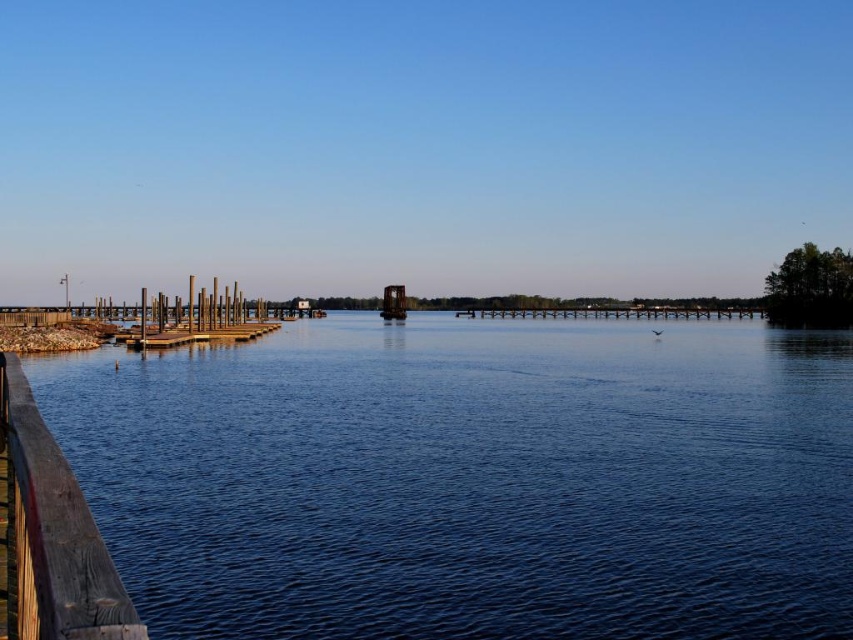
You are standing on a dock and see the blue water at lower left and the wooden textured rail at lower left. Which object is positioned lower in the scene?

The blue water at lower left is located below the wooden textured rail at lower left, so it is positioned lower in the scene.

You are standing on a wooden dock and want to walk towards the farther point. Which point should you head towards, point (801, 557) or point (387, 285)?

You should head towards point (387, 285) because it is farther from the viewer compared to point (801, 557), which is closer.

You are standing on a dock and want to know if the blue water at lower left is larger in size compared to the brown wooden rail at center. Based on the scene, can you confirm this?

The blue water at lower left is bigger than the brown wooden rail at center, so yes, the blue water at lower left is larger in size compared to the brown wooden rail at center.